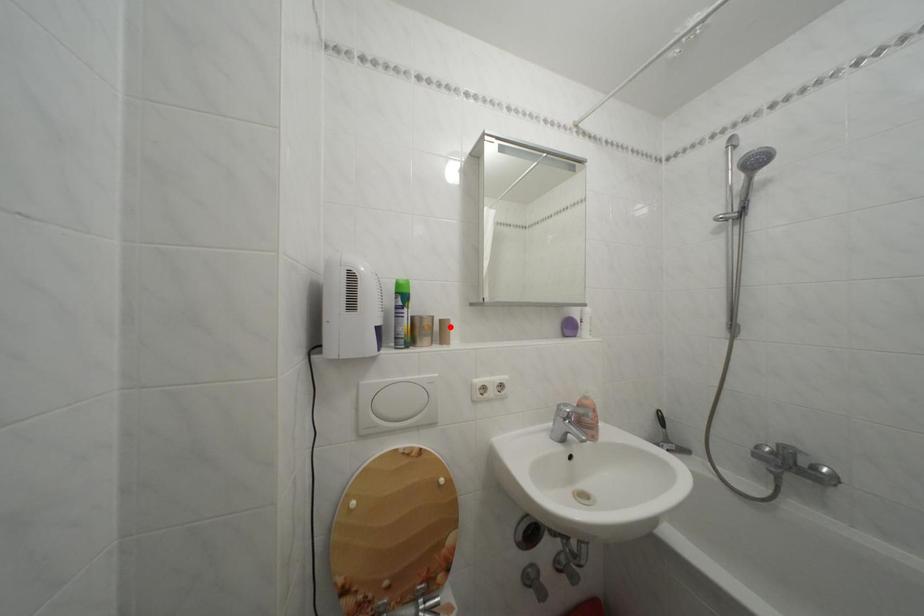
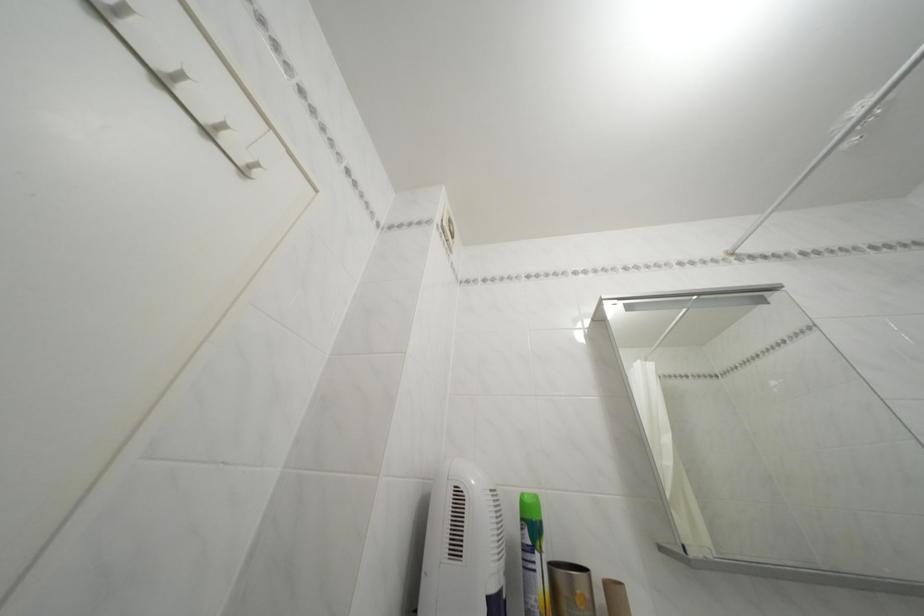
Where in the second image is the point corresponding to the highlighted location from the first image?

(614, 591)